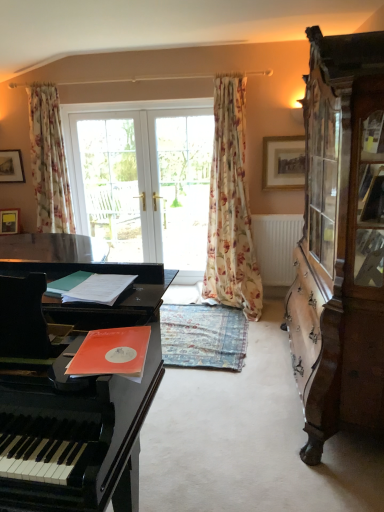
Question: Is wooden cabinet at right at the left side of floral fabric curtain at upper left, which is the 1th curtain from left to right?

Choices:
 (A) yes
 (B) no

Answer: (B)

Question: Is wooden cabinet at right far from floral fabric curtain at upper left, acting as the 2th curtain starting from the right?

Choices:
 (A) yes
 (B) no

Answer: (A)

Question: Is the position of wooden cabinet at right less distant than that of floral fabric curtain at upper left, acting as the 2th curtain starting from the right?

Choices:
 (A) no
 (B) yes

Answer: (B)

Question: From a real-world perspective, does wooden cabinet at right sit lower than floral fabric curtain at upper left, which is the 1th curtain from left to right?

Choices:
 (A) no
 (B) yes

Answer: (B)

Question: Is wooden cabinet at right placed right next to floral fabric curtain at upper left, which is the 1th curtain from left to right?

Choices:
 (A) yes
 (B) no

Answer: (B)

Question: Considering the positions of white glass doors at center and white glossy door at center, which is the first screen door from right to left, in the image, is white glass doors at center taller or shorter than white glossy door at center, which is the first screen door from right to left,?

Choices:
 (A) tall
 (B) short

Answer: (A)

Question: From a real-world perspective, is white glass doors at center physically located above or below white glossy door at center, which ranks as the 2th screen door in left-to-right order?

Choices:
 (A) below
 (B) above

Answer: (A)

Question: In the image, is white glass doors at center on the left side or the right side of white glossy door at center, which ranks as the 2th screen door in left-to-right order?

Choices:
 (A) left
 (B) right

Answer: (A)

Question: Is point (160, 172) closer or farther from the camera than point (203, 115)?

Choices:
 (A) closer
 (B) farther

Answer: (B)

Question: In terms of height, does floral fabric curtain at center, the first curtain from the right, look taller or shorter compared to white matte radiator at center?

Choices:
 (A) short
 (B) tall

Answer: (B)

Question: In terms of size, does floral fabric curtain at center, the 2th curtain positioned from the left, appear bigger or smaller than white matte radiator at center?

Choices:
 (A) big
 (B) small

Answer: (A)

Question: From a real-world perspective, is floral fabric curtain at center, the first curtain from the right, above or below white matte radiator at center?

Choices:
 (A) below
 (B) above

Answer: (B)

Question: From the image's perspective, is floral fabric curtain at center, the 2th curtain positioned from the left, above or below white matte radiator at center?

Choices:
 (A) above
 (B) below

Answer: (A)

Question: From a real-world perspective, is white glass doors at center positioned above or below black polished piano at left?

Choices:
 (A) above
 (B) below

Answer: (A)

Question: Is point (114, 225) positioned closer to the camera than point (71, 476)?

Choices:
 (A) closer
 (B) farther

Answer: (B)